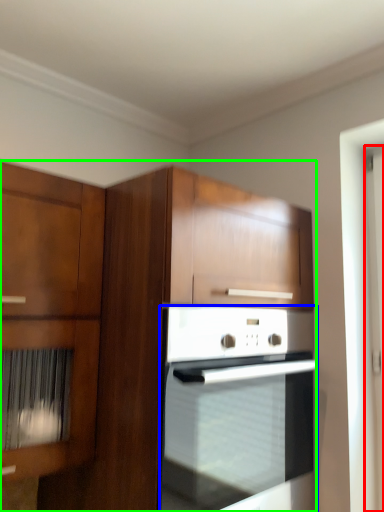
Question: Estimate the real-world distances between objects in this image. Which object is farther from screen door (highlighted by a red box), oven (highlighted by a blue box) or cabinetry (highlighted by a green box)?

Choices:
 (A) oven
 (B) cabinetry

Answer: (B)